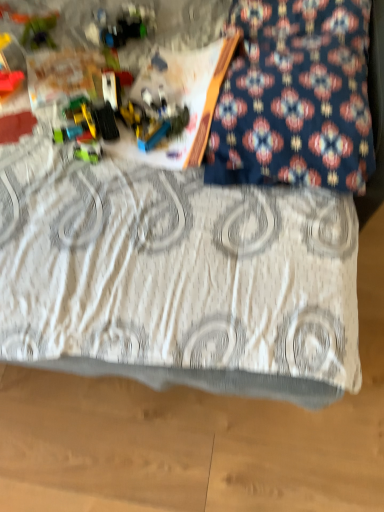
Question: From their relative heights in the image, would you say green plastic toy at upper left, arranged as the 2th toy when ordered from the bottom, is taller or shorter than white textured blanket at center?

Choices:
 (A) short
 (B) tall

Answer: (A)

Question: Choose the correct answer: Is green plastic toy at upper left, which is the 2th toy from top to bottom, inside white textured blanket at center or outside it?

Choices:
 (A) outside
 (B) inside

Answer: (B)

Question: Considering the real-world distances, which object is closest to the dark blue patterned pillow at upper right?

Choices:
 (A) white textured blanket at center
 (B) green plastic toy at upper left, which is the 2th toy from top to bottom
 (C) translucent plastic construction set at upper left, positioned as the 3th toy in top-to-bottom order
 (D) shiny plastic toy at upper left, which is the 1th toy in top-to-bottom order

Answer: (A)

Question: Estimate the real-world distances between objects in this image. Which object is closer to the shiny plastic toy at upper left, which is the 1th toy in top-to-bottom order?

Choices:
 (A) dark blue patterned pillow at upper right
 (B) white textured blanket at center
 (C) translucent plastic construction set at upper left, the 1th toy in the bottom-to-top sequence
 (D) green plastic toy at upper left, arranged as the 2th toy when ordered from the bottom

Answer: (D)